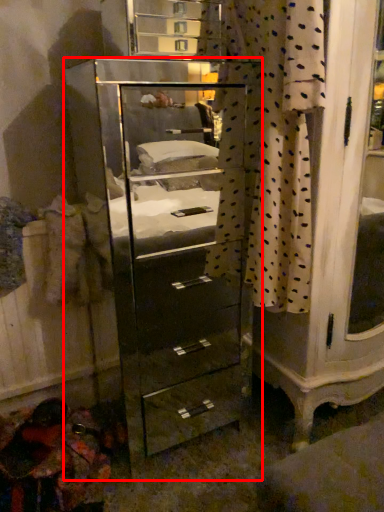
Question: Observing the image, what is the correct spatial positioning of chest of drawers (annotated by the red box) in reference to curtain?

Choices:
 (A) right
 (B) left

Answer: (B)